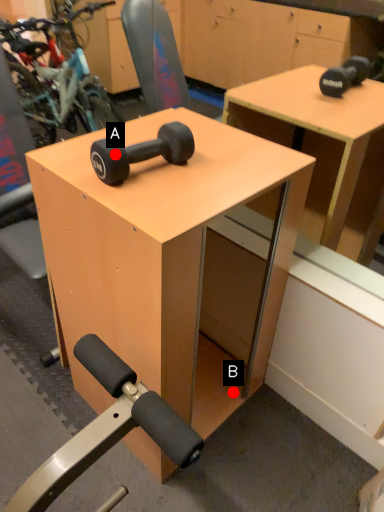
Question: Two points are circled on the image, labeled by A and B beside each circle. Among these points, which one is farthest from the camera?

Choices:
 (A) A is further
 (B) B is further

Answer: (B)